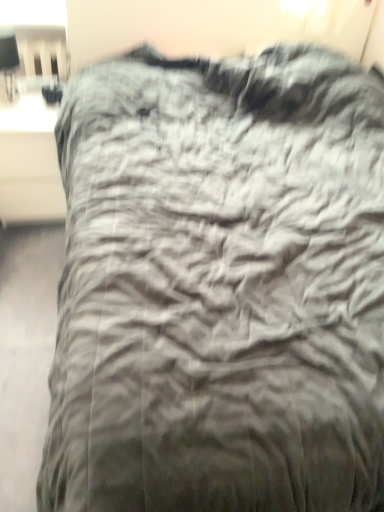
Question: Can you confirm if matte white table at left is shorter than matte black lampshade at upper left?

Choices:
 (A) no
 (B) yes

Answer: (A)

Question: Is matte white table at left aimed at matte black lampshade at upper left?

Choices:
 (A) no
 (B) yes

Answer: (A)

Question: Can you confirm if matte white table at left is smaller than matte black lampshade at upper left?

Choices:
 (A) yes
 (B) no

Answer: (B)

Question: From the image's perspective, does matte white table at left appear higher than matte black lampshade at upper left?

Choices:
 (A) no
 (B) yes

Answer: (A)

Question: Is matte white table at left taller than matte black lampshade at upper left?

Choices:
 (A) no
 (B) yes

Answer: (B)

Question: Does matte white table at left have a lesser width compared to matte black lampshade at upper left?

Choices:
 (A) no
 (B) yes

Answer: (A)

Question: Are matte black lampshade at upper left and matte white table at left far apart?

Choices:
 (A) yes
 (B) no

Answer: (B)

Question: Is matte black lampshade at upper left closer to the viewer compared to matte white table at left?

Choices:
 (A) yes
 (B) no

Answer: (A)

Question: Is matte white table at left at the back of matte black lampshade at upper left?

Choices:
 (A) no
 (B) yes

Answer: (A)

Question: Is matte black lampshade at upper left oriented towards matte white table at left?

Choices:
 (A) yes
 (B) no

Answer: (B)

Question: Is matte black lampshade at upper left next to matte white table at left?

Choices:
 (A) yes
 (B) no

Answer: (B)

Question: Is matte black lampshade at upper left wider than matte white table at left?

Choices:
 (A) no
 (B) yes

Answer: (A)

Question: From a real-world perspective, is matte white table at left positioned above or below matte black lampshade at upper left?

Choices:
 (A) below
 (B) above

Answer: (A)